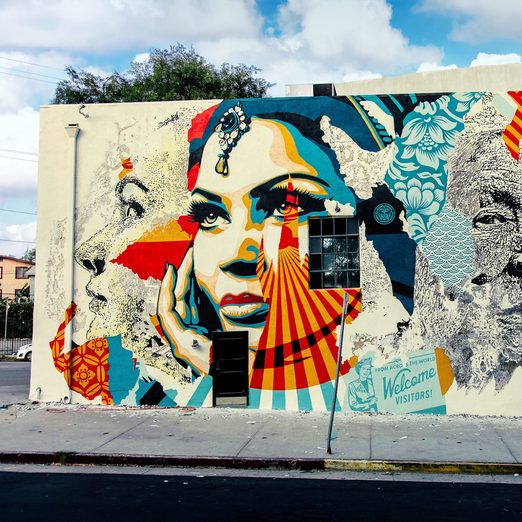
Identify the location of mural eyes. The height and width of the screenshot is (522, 522). [x=212, y=217], [x=284, y=206].